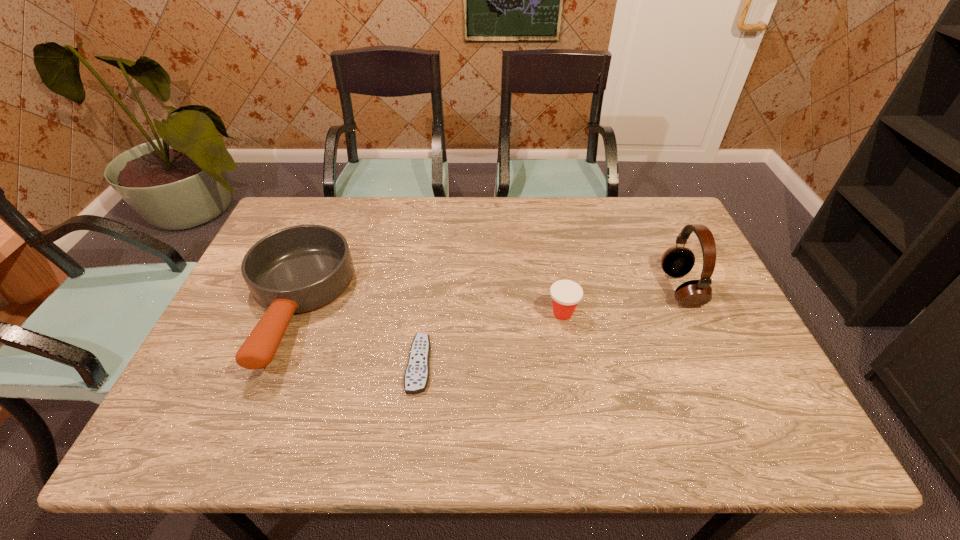
Image resolution: width=960 pixels, height=540 pixels. I want to click on object that stands as the second closest to the tallest object, so 416,377.

Locate which object is the closest to the third object from left to right. Please provide its 2D coordinates. Your answer should be formatted as a tuple, i.e. [(x, y)], where the tuple contains the x and y coordinates of a point satisfying the conditions above.

[(677, 261)]

You are a GUI agent. You are given a task and a screenshot of the screen. Output one action in this format:
    pyautogui.click(x=<x>, y=<y>)
    Task: Click on the vacant space that satisfies the following two spatial constraints: 1. on the ear pads of the headset; 2. on the handle side of the leftmost object
    
    Given the screenshot: What is the action you would take?
    pyautogui.click(x=688, y=306)

This screenshot has height=540, width=960. What are the coordinates of `free location that satisfies the following two spatial constraints: 1. on the handle side of the shortest object; 2. on the right side of the second tallest object` in the screenshot? It's located at [x=271, y=364].

The height and width of the screenshot is (540, 960). In order to click on free spot that satisfies the following two spatial constraints: 1. on the handle side of the third object from left to right; 2. on the left side of the leftmost object in this screenshot , I will do `click(291, 313)`.

Find the location of a particular element. This screenshot has height=540, width=960. free space that satisfies the following two spatial constraints: 1. on the ear pads of the tallest object; 2. on the handle side of the pan is located at coordinates (688, 306).